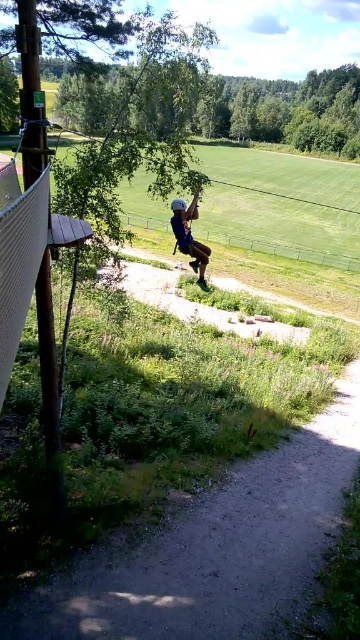
Question: Which object appears farthest from the camera in this image?

Choices:
 (A) blue fabric helmet at center
 (B) dirt/gravel path at lower center

Answer: (A)

Question: Is dirt/gravel path at lower center further to the viewer compared to blue fabric helmet at center?

Choices:
 (A) yes
 (B) no

Answer: (B)

Question: Does dirt/gravel path at lower center have a larger size compared to blue fabric helmet at center?

Choices:
 (A) no
 (B) yes

Answer: (A)

Question: Is dirt/gravel path at lower center bigger than blue fabric helmet at center?

Choices:
 (A) yes
 (B) no

Answer: (B)